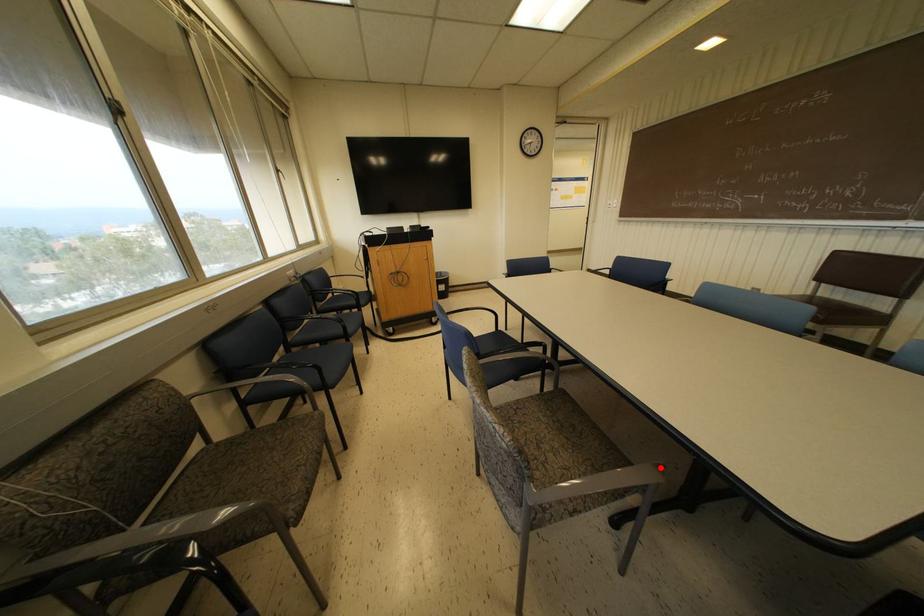
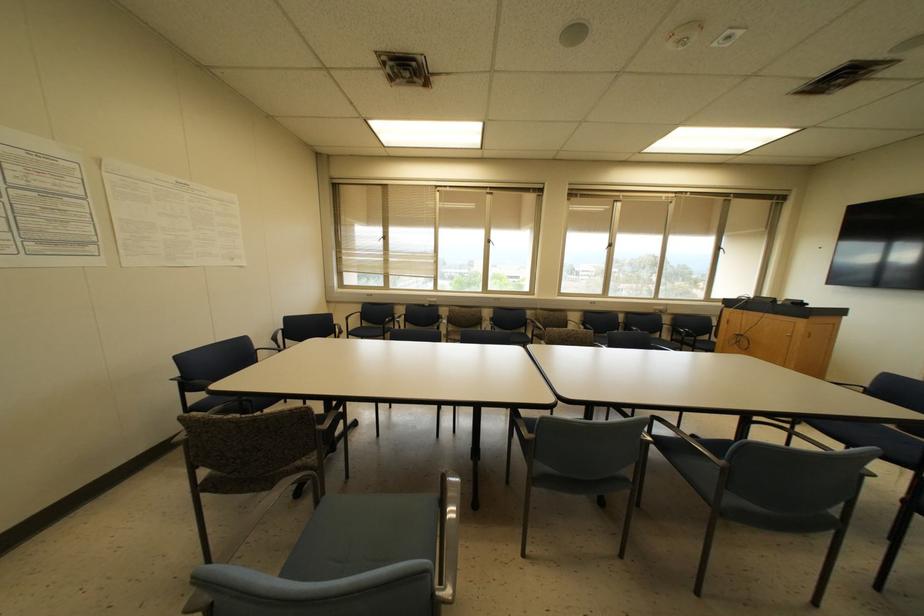
Question: I am providing you with two images of the same scene from different viewpoints. A red point is marked on the first image. Is the red point's position out of view in image 2?

Choices:
 (A) Yes
 (B) No

Answer: (A)